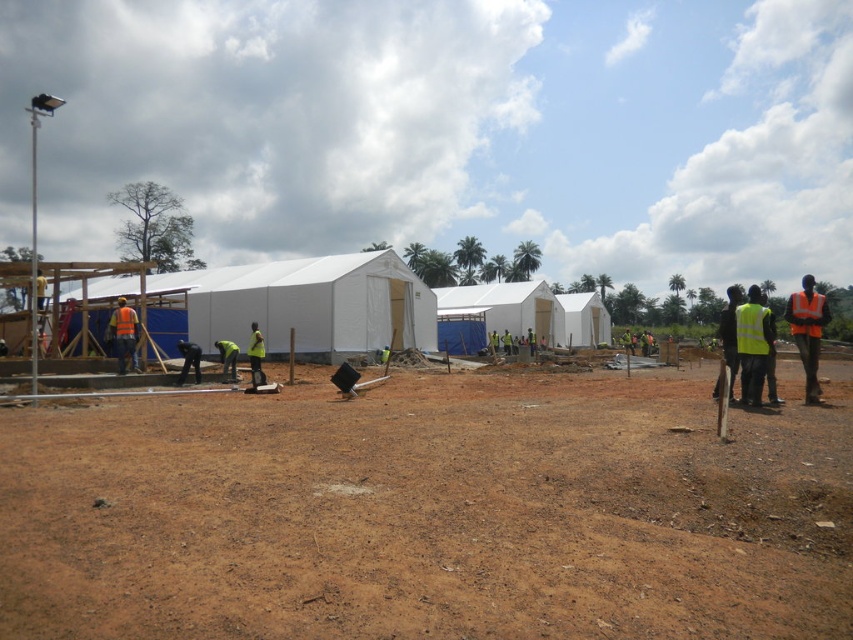
Question: Can you confirm if brown sandy dirt at lower center is wider than yellow reflective safety vest at right?

Choices:
 (A) yes
 (B) no

Answer: (A)

Question: From the image, what is the correct spatial relationship of orange reflective safety vest at left in relation to green reflective vest at center?

Choices:
 (A) right
 (B) left

Answer: (B)

Question: Can you confirm if yellow reflective safety vest at right is positioned above orange reflective safety vest at left?

Choices:
 (A) yes
 (B) no

Answer: (B)

Question: Which of the following is the closest to the observer?

Choices:
 (A) (350, 499)
 (B) (809, 307)
 (C) (821, 323)

Answer: (A)

Question: Which point is closer to the camera?

Choices:
 (A) green reflective vest at center
 (B) yellow reflective vest at center
 (C) yellow reflective safety vest at right

Answer: (C)

Question: Which of these objects is positioned closest to the yellow reflective safety vest at right?

Choices:
 (A) brown sandy dirt at lower center
 (B) high visibility yellow vest at right

Answer: (B)